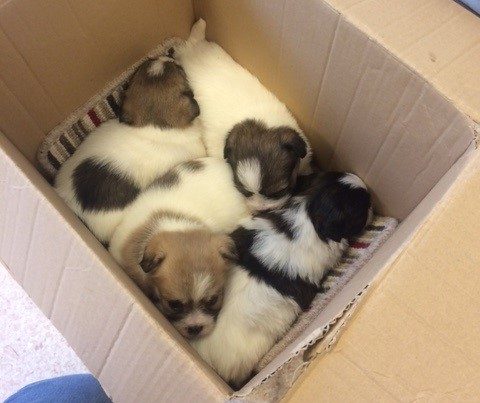
I want to click on carpet, so click(x=19, y=339).